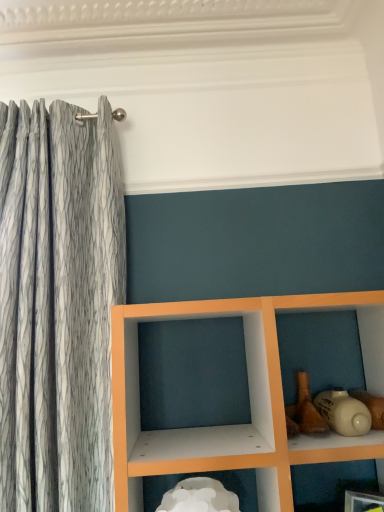
This screenshot has height=512, width=384. In order to click on vacant space situated above white matte cloud at lower center (from a real-world perspective) in this screenshot , I will do `click(192, 480)`.